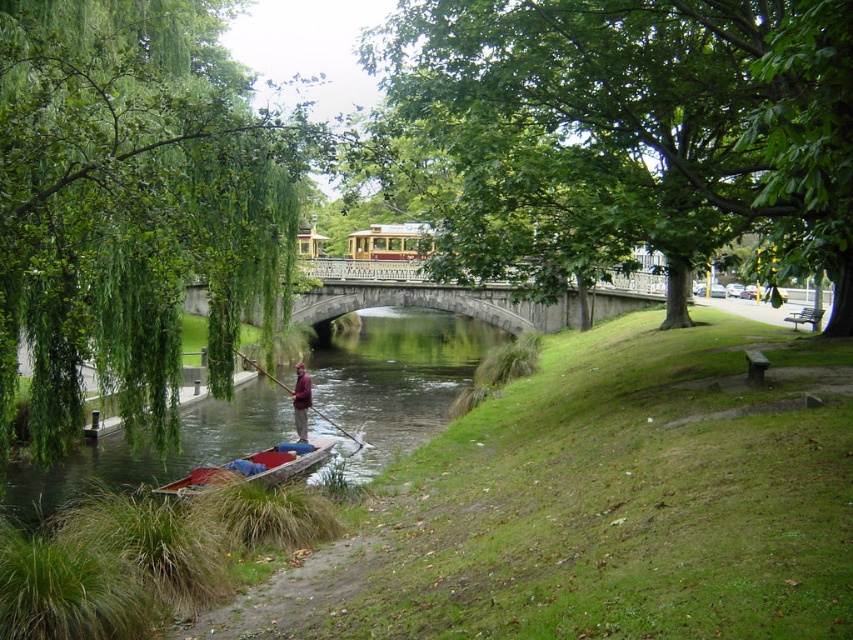
You are a painter setting up an easel to paint this riverside scene. You want to ensure the brown wooden boat at lower left and the maroon fabric shirt at center are both clearly visible in your painting. Considering their heights, which object should you place higher up in your composition to maintain their relative sizes?

The brown wooden boat at lower left has a greater height compared to the maroon fabric shirt at center, so you should place the brown wooden boat at lower left higher up in your composition to maintain their relative sizes.

You are standing at the point marked by coordinates point [631,129] in the riverside scene. What object is located exactly at that point?

The point [631,129] marks green leafy tree at center.

You are a photographer standing at the riverside. You want to take a photo of the brown wooden boat at lower left and the green leafy tree at center. Which object should you focus on first if you want to capture both in the frame without moving your camera?

The green leafy tree at center is positioned on the right side of brown wooden boat at lower left, so you should focus on the brown wooden boat at lower left first to ensure both are in the frame.